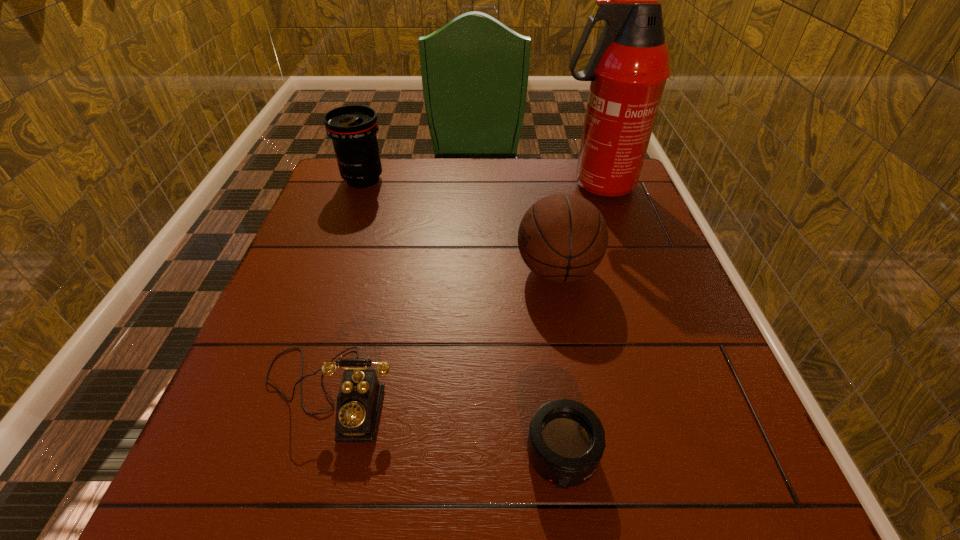
Where is `free spot located 0.230m on the right of the taller telephoto lens`? free spot located 0.230m on the right of the taller telephoto lens is located at coordinates (467, 179).

At what (x,y) coordinates should I click in order to perform the action: click on free spot located on the side with brand label of the third nearest object. Please return your answer as a coordinate pair (x, y). Image resolution: width=960 pixels, height=540 pixels. Looking at the image, I should click on (342, 271).

At what (x,y) coordinates should I click in order to perform the action: click on vacant region located on the side with brand label of the third nearest object. Please return your answer as a coordinate pair (x, y). This screenshot has width=960, height=540. Looking at the image, I should click on (467, 271).

The width and height of the screenshot is (960, 540). I want to click on vacant space located on the side with brand label of the third nearest object, so click(x=396, y=271).

Find the location of a particular element. vacant space located 0.050m on the dial of the telephone is located at coordinates [305, 476].

The height and width of the screenshot is (540, 960). Identify the location of fire extinguisher situated at the far edge. (628, 69).

You are a GUI agent. You are given a task and a screenshot of the screen. Output one action in this format:
    pyautogui.click(x=<x>, y=<y>)
    Task: Click on the telephoto lens located at the far edge
    
    Given the screenshot: What is the action you would take?
    pyautogui.click(x=352, y=128)

The width and height of the screenshot is (960, 540). What are the coordinates of `object situated at the near edge` in the screenshot? It's located at (566, 440).

Image resolution: width=960 pixels, height=540 pixels. What are the coordinates of `telephoto lens that is at the left edge` in the screenshot? It's located at coord(352,128).

I want to click on telephone located at the left edge, so click(360, 395).